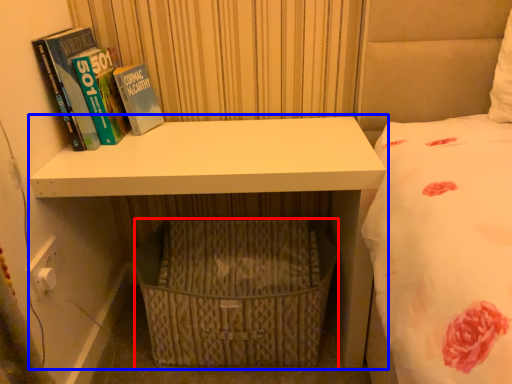
Question: Among these objects, which one is nearest to the camera, basket (highlighted by a red box) or shelf (highlighted by a blue box)?

Choices:
 (A) basket
 (B) shelf

Answer: (B)